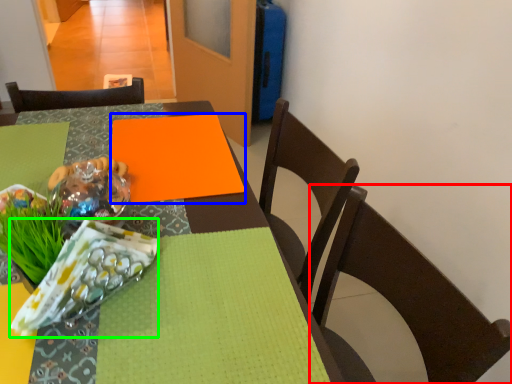
Question: Considering the real-world distances, which object is farthest from chair (highlighted by a red box)? linen (highlighted by a blue box) or material (highlighted by a green box)?

Choices:
 (A) linen
 (B) material

Answer: (B)